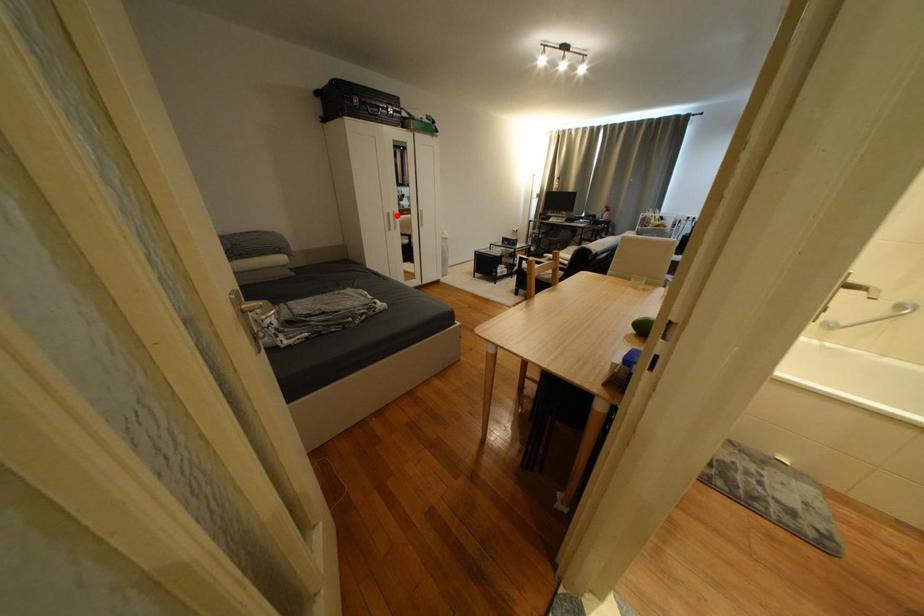
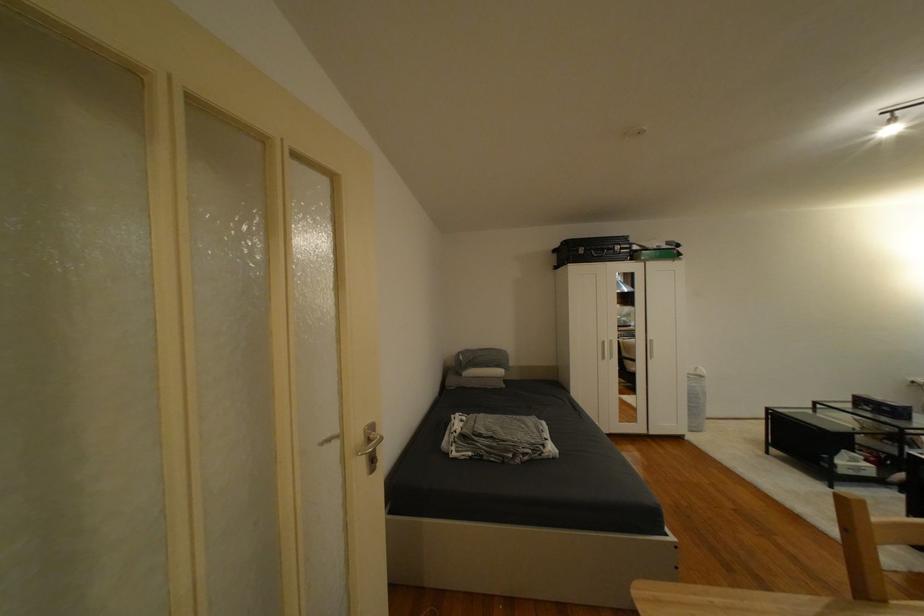
In the second image, find the point that corresponds to the highlighted location in the first image.

(612, 344)